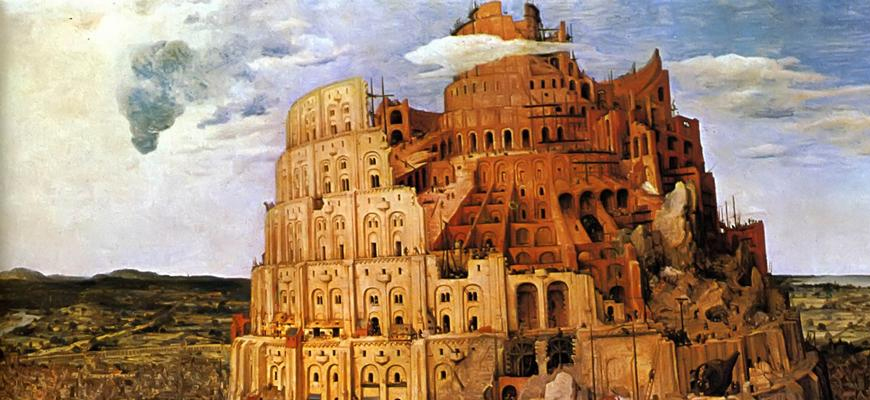
Identify the location of window. (397, 298).